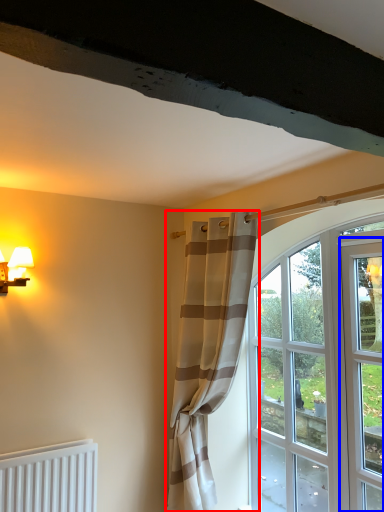
Question: Among these objects, which one is nearest to the camera, curtain (highlighted by a red box) or screen door (highlighted by a blue box)?

Choices:
 (A) curtain
 (B) screen door

Answer: (B)